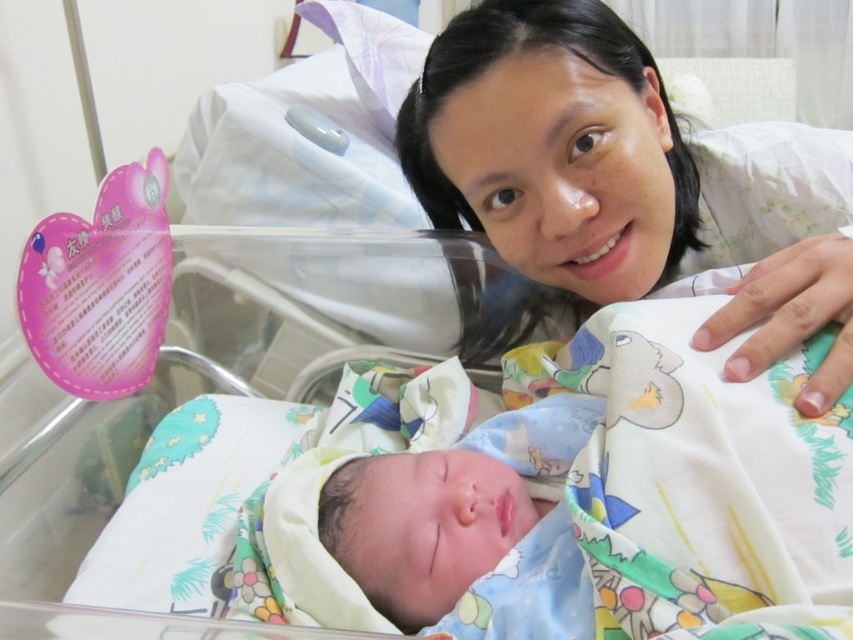
What do you see at coordinates (553, 147) in the screenshot?
I see `white fabric at upper center` at bounding box center [553, 147].

Is point (674, 209) positioned after point (444, 509)?

Yes.

Is point (573, 93) positioned before point (532, 449)?

Yes, point (573, 93) is in front of point (532, 449).

The width and height of the screenshot is (853, 640). What are the coordinates of `white fabric at upper center` in the screenshot? It's located at tap(553, 147).